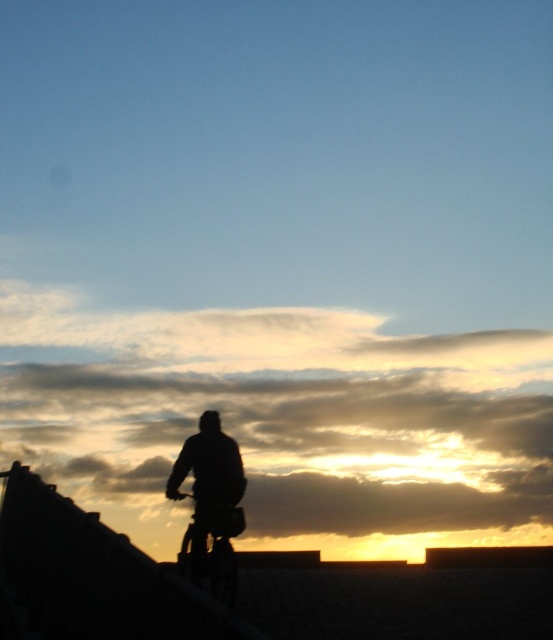
Which of these two, silhouette fabric at center or metallic silver bicycle at center, stands shorter?

metallic silver bicycle at center

Measure the distance between point (244,484) and camera.

Point (244,484) is 32.52 feet from camera.

The width and height of the screenshot is (553, 640). I want to click on silhouette fabric at center, so click(208, 477).